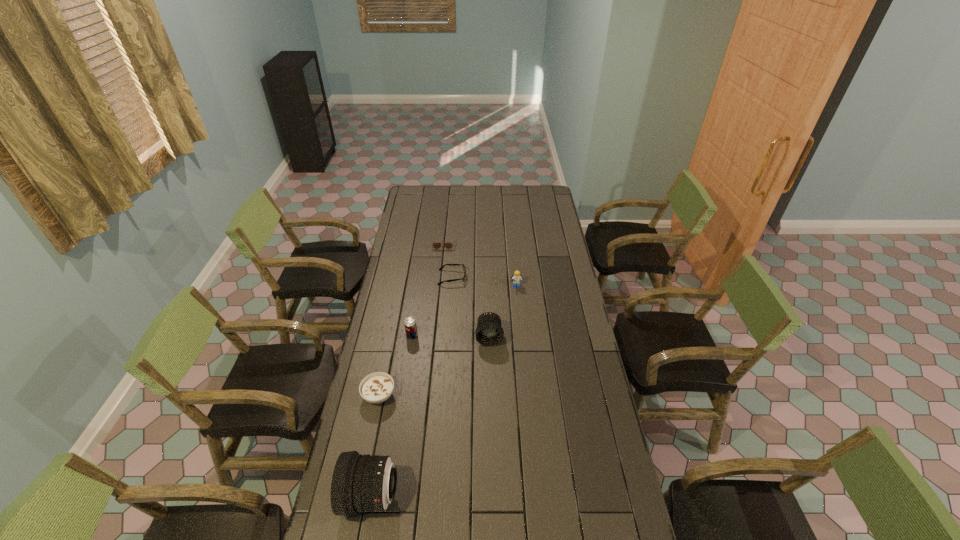
The image size is (960, 540). I want to click on free spot located at the front element of the shorter telephoto lens, so click(x=491, y=412).

Locate an element on the screen. vacant space located 0.350m on the front-facing side of the shortest object is located at coordinates (537, 278).

Where is `free space located 0.310m on the right of the beer can`? The image size is (960, 540). free space located 0.310m on the right of the beer can is located at coordinates (490, 336).

Locate an element on the screen. The height and width of the screenshot is (540, 960). vacant space located 0.390m on the front-facing side of the rightmost object is located at coordinates (522, 353).

At what (x,y) coordinates should I click in order to perform the action: click on free space located on the front-facing side of the sunglasses. Please return your answer as a coordinate pair (x, y). Looking at the image, I should click on (438, 293).

This screenshot has height=540, width=960. I want to click on free space located 0.370m on the back of the soup bowl, so click(x=396, y=314).

Locate an element on the screen. This screenshot has height=540, width=960. object at the near edge is located at coordinates (361, 483).

Locate an element on the screen. The height and width of the screenshot is (540, 960). telephoto lens that is positioned at the left edge is located at coordinates (361, 483).

You are a GUI agent. You are given a task and a screenshot of the screen. Output one action in this format:
    pyautogui.click(x=<x>, y=<y>)
    Task: Click on the beer can positioned at the left edge
    This screenshot has height=540, width=960.
    Given the screenshot: What is the action you would take?
    pyautogui.click(x=410, y=325)

Locate an element on the screen. soup bowl that is at the left edge is located at coordinates (375, 388).